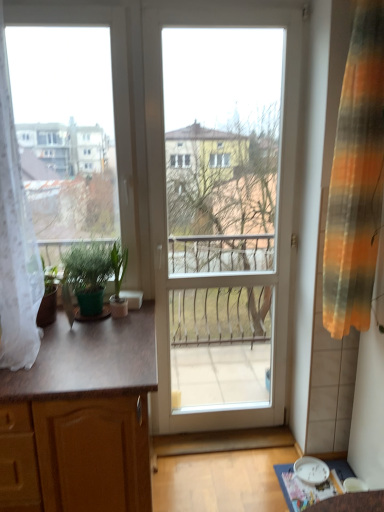
Where is `free space in front of green matte plant at left, positioned as the second houseplant in left-to-right order`? The image size is (384, 512). free space in front of green matte plant at left, positioned as the second houseplant in left-to-right order is located at coordinates (113, 327).